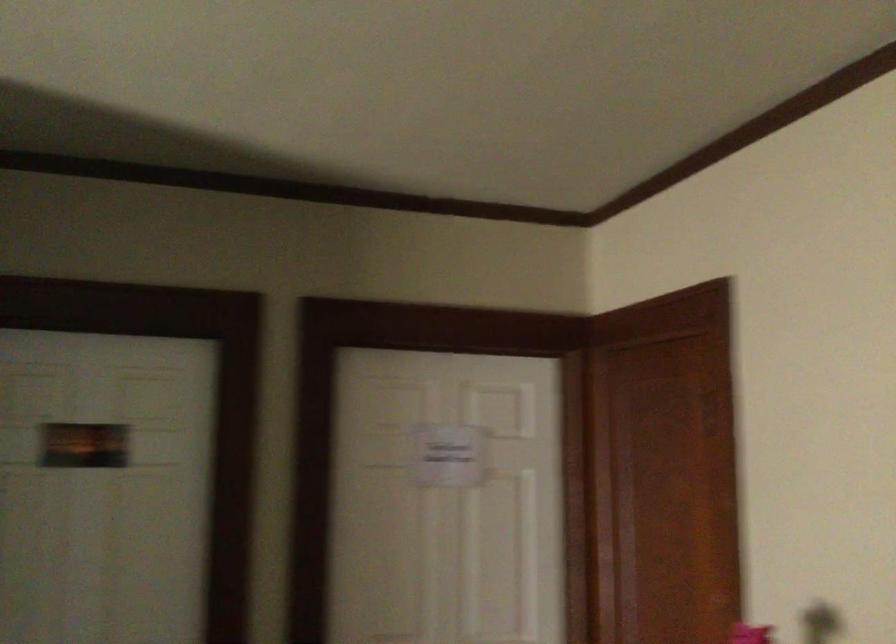
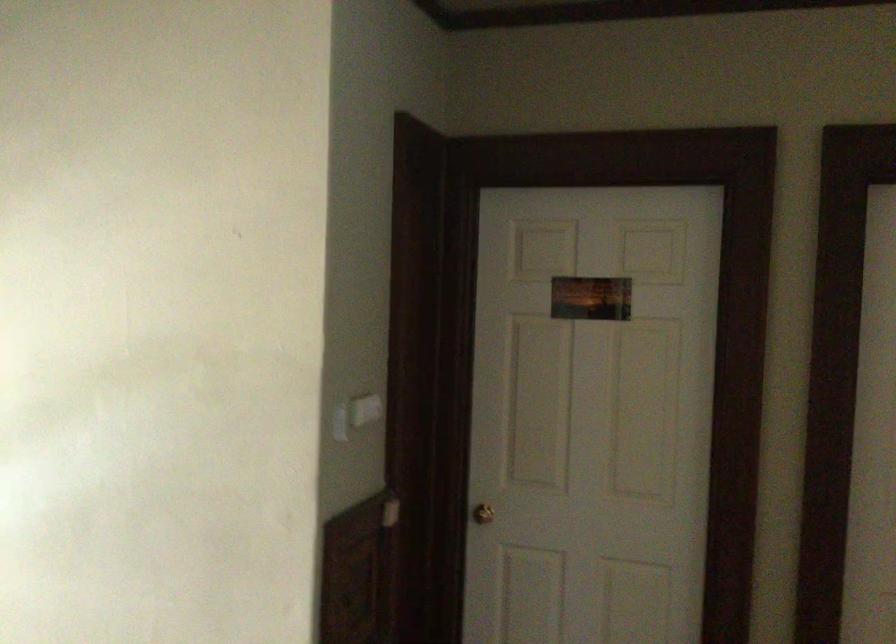
Question: The images are taken continuously from a first-person perspective. In which direction is your viewpoint rotating?

Choices:
 (A) Left
 (B) Right
 (C) Up
 (D) Down

Answer: (A)